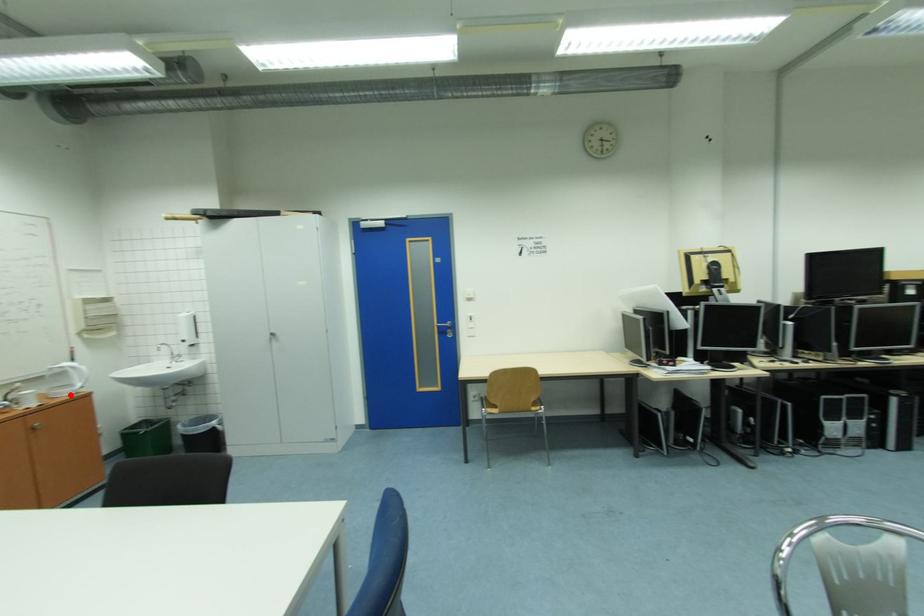
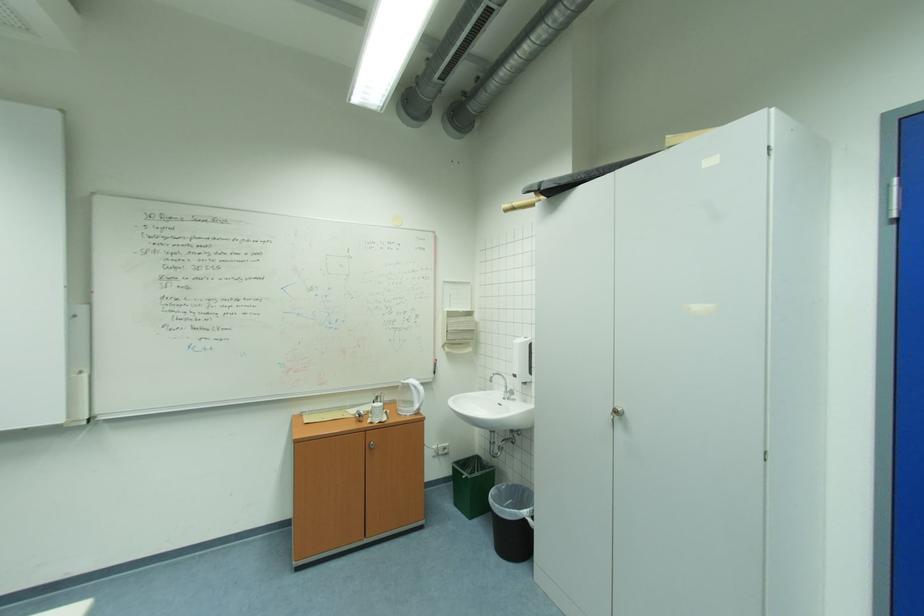
Locate, in the second image, the point that corresponds to the highlighted location in the first image.

(415, 411)